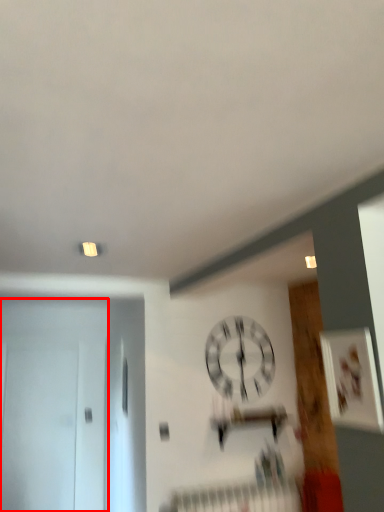
Question: From the image's perspective, where is door (annotated by the red box) located in relation to wall clock in the image?

Choices:
 (A) above
 (B) below

Answer: (B)